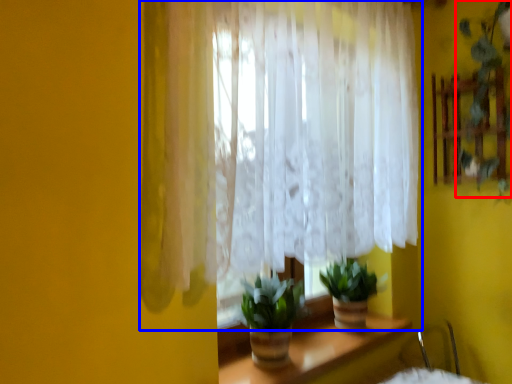
Question: Which object appears farthest to the camera in this image, plant (highlighted by a red box) or curtain (highlighted by a blue box)?

Choices:
 (A) plant
 (B) curtain

Answer: (A)